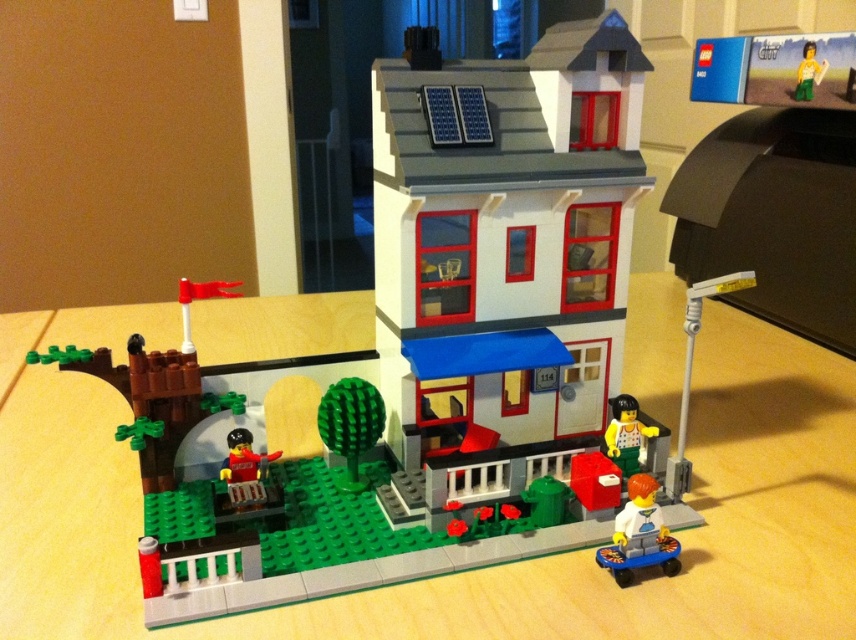
You are a visitor approaching the LEGO house and see both the light green plastic minifigure at lower right and the yellow matte figure at center. Which figure appears larger to you from your current viewpoint?

The light green plastic minifigure at lower right appears larger because it is much taller than the yellow matte figure at center.

You are a visitor approaching the LEGO house and see both the light green plastic minifigure at lower right and the yellow matte figure at center. Which figure is closer to the ground?

The light green plastic minifigure at lower right is closer to the ground because it is located below the yellow matte figure at center.

In the scene shown: You are a visitor approaching the LEGO house from the front. You see a light green plastic minifigure at lower right and a yellow matte figure at center. Which figure is standing closer to the entrance of the house?

The light green plastic minifigure at lower right is closer to the entrance of the house because it is positioned closer to the viewer than the yellow matte figure at center.